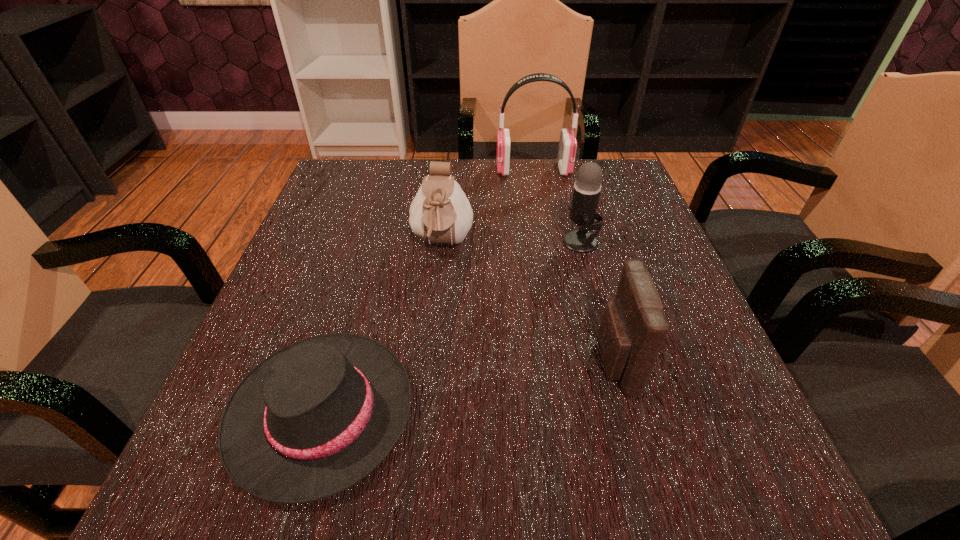
Locate an element on the screen. empty location between the nearer pouch and the microphone is located at coordinates (597, 302).

The image size is (960, 540). I want to click on vacant space that is in between the microphone and the shortest object, so click(x=451, y=328).

This screenshot has height=540, width=960. In order to click on vacant area that lies between the microphone and the farther pouch in this screenshot , I will do 512,244.

At what (x,y) coordinates should I click in order to perform the action: click on free point between the microphone and the farther pouch. Please return your answer as a coordinate pair (x, y). Looking at the image, I should click on (512, 244).

What are the coordinates of `empty location between the microphone and the shortest object` in the screenshot? It's located at (451, 328).

The height and width of the screenshot is (540, 960). I want to click on free space between the microphone and the shortest object, so click(451, 328).

You are a GUI agent. You are given a task and a screenshot of the screen. Output one action in this format:
    pyautogui.click(x=<x>, y=<y>)
    Task: Click on the free spot between the microphone and the shortest object
    Image resolution: width=960 pixels, height=540 pixels.
    Given the screenshot: What is the action you would take?
    pyautogui.click(x=451, y=328)

Locate an element on the screen. The image size is (960, 540). vacant area between the farther pouch and the microphone is located at coordinates (512, 244).

This screenshot has width=960, height=540. I want to click on free spot between the nearer pouch and the earphone, so click(x=574, y=266).

Locate an element on the screen. free space between the left pouch and the dress hat is located at coordinates (382, 329).